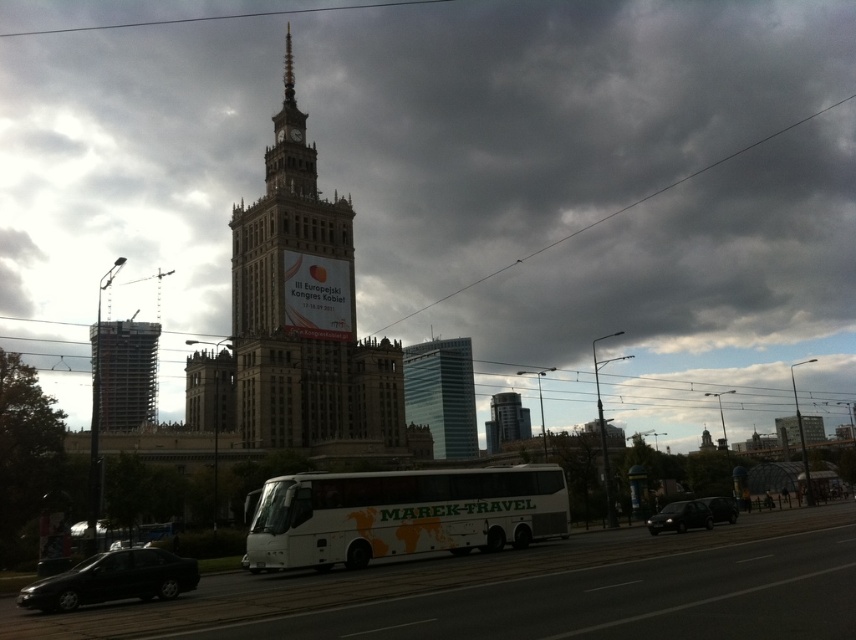
Question: Which point appears closest to the camera in this image?

Choices:
 (A) (498, 403)
 (B) (25, 588)
 (C) (663, 522)
 (D) (708, 296)

Answer: (B)

Question: Estimate the real-world distances between objects in this image. Which object is closer to the black glossy sedan at center?

Choices:
 (A) white matte bus at center
 (B) black glossy car at lower right

Answer: (B)

Question: Estimate the real-world distances between objects in this image. Which object is closer to the white matte bus at center?

Choices:
 (A) gray stone tower at center
 (B) black glossy sedan at center

Answer: (A)

Question: Does shiny black sedan at lower left have a greater width compared to glassy modern skyscraper at center?

Choices:
 (A) yes
 (B) no

Answer: (A)

Question: Does gray stone tower at center have a greater width compared to white matte bus at center?

Choices:
 (A) yes
 (B) no

Answer: (B)

Question: Considering the relative positions of white matte bus at center and shiny black sedan at lower left in the image provided, where is white matte bus at center located with respect to shiny black sedan at lower left?

Choices:
 (A) above
 (B) below

Answer: (A)